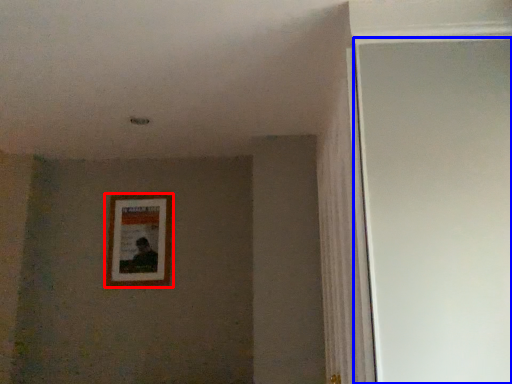
Question: Among these objects, which one is nearest to the camera, picture frame (highlighted by a red box) or glass door (highlighted by a blue box)?

Choices:
 (A) picture frame
 (B) glass door

Answer: (B)